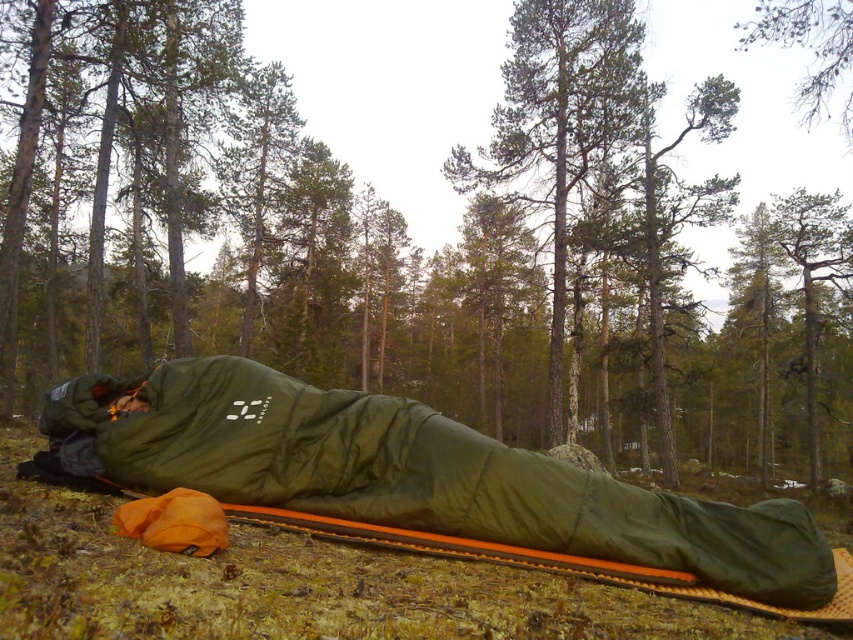
You are a hiker who needs to set up a tent between the olive green fabric sleeping bag at center and the green matte tree at upper center. The tent requires a minimum of 15 meters of space. Is there enough space available?

The distance between the olive green fabric sleeping bag at center and the green matte tree at upper center is 17.60 meters, which is more than the required 15 meters. Therefore, there is sufficient space to set up the tent.

What is located at the coordinate point (558,122) in the image?

The green textured tree at center is located at the coordinate point (558,122).

What is the object located at the coordinates point (415, 476) in the image?

The object located at point (415, 476) is the olive green fabric sleeping bag at center.